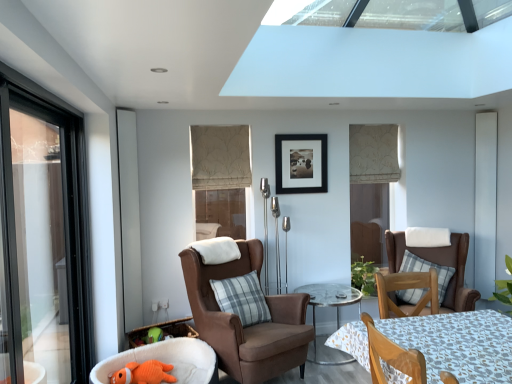
Question: Would you say suede brown armchair at center, which is the third chair from right to left, is to the left or to the right of wooden chair at lower right, which is the second chair from right to left, in the picture?

Choices:
 (A) right
 (B) left

Answer: (B)

Question: Does point (217, 339) appear closer or farther from the camera than point (410, 349)?

Choices:
 (A) farther
 (B) closer

Answer: (A)

Question: Based on their relative distances, which object is farther from the clear glass table at center?

Choices:
 (A) suede brown armchair at center, arranged as the second chair when viewed from the left
 (B) beige textured roman shade at center, the second window viewed from the back
 (C) orange plush toy at lower left, positioned as the first chair in left-to-right order
 (D) white glossy screen door at left, the second screen door from the right
 (E) gray plaid pillow at center, marked as the second pillow in a right-to-left arrangement

Answer: (D)

Question: Based on their relative distances, which object is farther from the gray plaid pillow at center, which ranks as the 2th pillow in back-to-front order?

Choices:
 (A) orange plush toy at lower left
 (B) suede brown armchair at center, arranged as the second chair when viewed from the left
 (C) black matte picture frame at center
 (D) wooden chair at lower right, the third chair viewed from the left
 (E) clear glass table at center

Answer: (D)